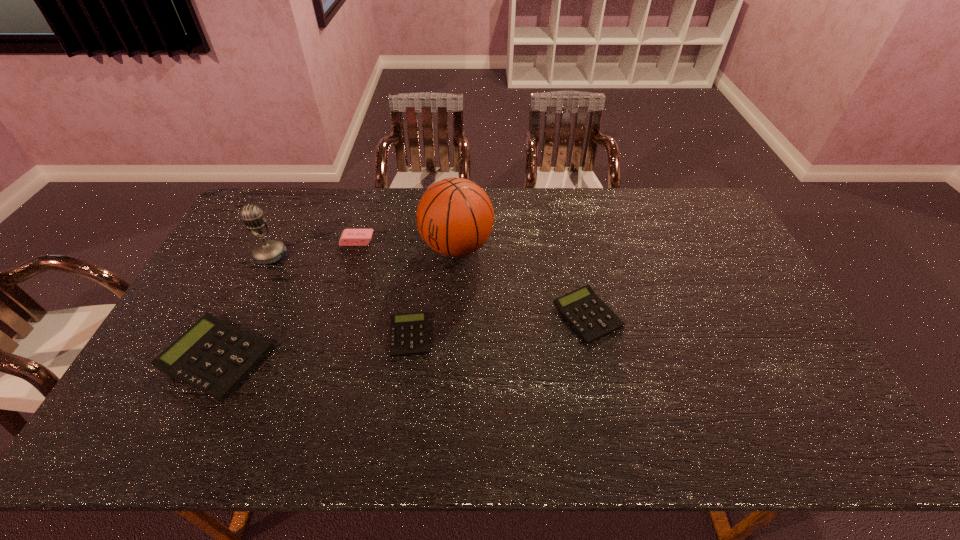
This screenshot has height=540, width=960. I want to click on vacant space located 0.190m on the left of the shortest object, so (320, 335).

At what (x,y) coordinates should I click in order to perform the action: click on vacant space situated on the back of the second shortest calculator. Please return your answer as a coordinate pair (x, y). This screenshot has width=960, height=540. Looking at the image, I should click on (565, 212).

Where is `vacant space positioned on the left of the tallest object`? This screenshot has width=960, height=540. vacant space positioned on the left of the tallest object is located at coordinates (405, 247).

Identify the location of vacant space located 0.090m on the right of the eraser. (400, 241).

Where is `vacant position located 0.310m on the front-facing side of the fifth shortest object`? The width and height of the screenshot is (960, 540). vacant position located 0.310m on the front-facing side of the fifth shortest object is located at coordinates (226, 348).

Identify the location of object present at the far edge. This screenshot has height=540, width=960. (455, 217).

Image resolution: width=960 pixels, height=540 pixels. Identify the location of object that is at the near edge. click(213, 356).

This screenshot has height=540, width=960. Identify the location of calculator that is at the left edge. pos(213,356).

At what (x,y) coordinates should I click in order to perform the action: click on microphone at the left edge. Please return your answer as a coordinate pair (x, y). The width and height of the screenshot is (960, 540). Looking at the image, I should click on (271, 251).

In order to click on object at the near left corner in this screenshot , I will do `click(213, 356)`.